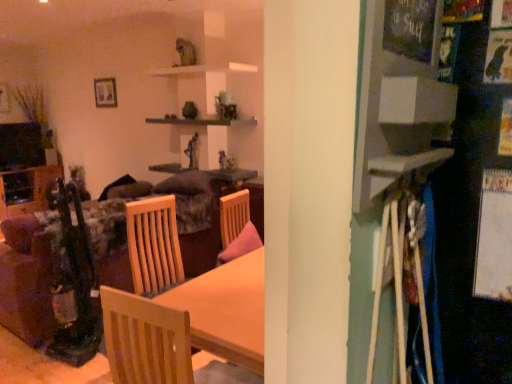
Question: Is wooden picture frame at upper left closer to camera compared to wooden table at center?

Choices:
 (A) no
 (B) yes

Answer: (A)

Question: From a real-world perspective, is wooden picture frame at upper left physically below wooden table at center?

Choices:
 (A) yes
 (B) no

Answer: (B)

Question: Does wooden picture frame at upper left touch wooden table at center?

Choices:
 (A) no
 (B) yes

Answer: (A)

Question: From a real-world perspective, is wooden picture frame at upper left physically above wooden table at center?

Choices:
 (A) yes
 (B) no

Answer: (A)

Question: From the image's perspective, does wooden picture frame at upper left appear lower than wooden table at center?

Choices:
 (A) no
 (B) yes

Answer: (A)

Question: Considering the relative sizes of wooden picture frame at upper left and wooden table at center in the image provided, is wooden picture frame at upper left thinner than wooden table at center?

Choices:
 (A) no
 (B) yes

Answer: (B)

Question: Can you confirm if wooden table at center is smaller than wooden picture frame at upper left?

Choices:
 (A) no
 (B) yes

Answer: (A)

Question: Is wooden table at center positioned before wooden picture frame at upper left?

Choices:
 (A) no
 (B) yes

Answer: (B)

Question: Is wooden table at center placed right next to wooden picture frame at upper left?

Choices:
 (A) yes
 (B) no

Answer: (B)

Question: From the image's perspective, is wooden table at center on top of wooden picture frame at upper left?

Choices:
 (A) no
 (B) yes

Answer: (A)

Question: Does wooden table at center have a larger size compared to wooden picture frame at upper left?

Choices:
 (A) yes
 (B) no

Answer: (A)

Question: Does wooden table at center have a lesser width compared to wooden picture frame at upper left?

Choices:
 (A) no
 (B) yes

Answer: (A)

Question: Is wooden table at center bigger than velvet floral couch at left?

Choices:
 (A) yes
 (B) no

Answer: (B)